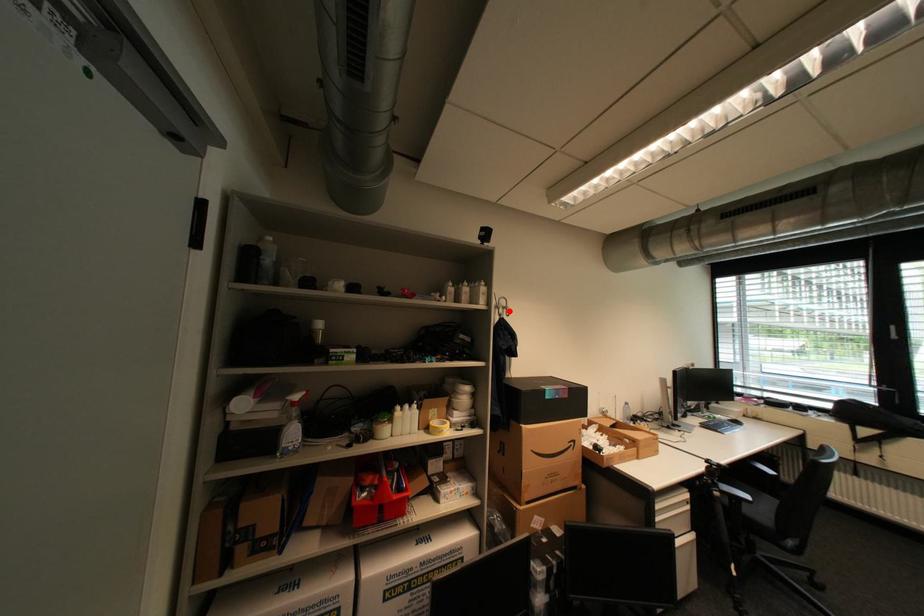
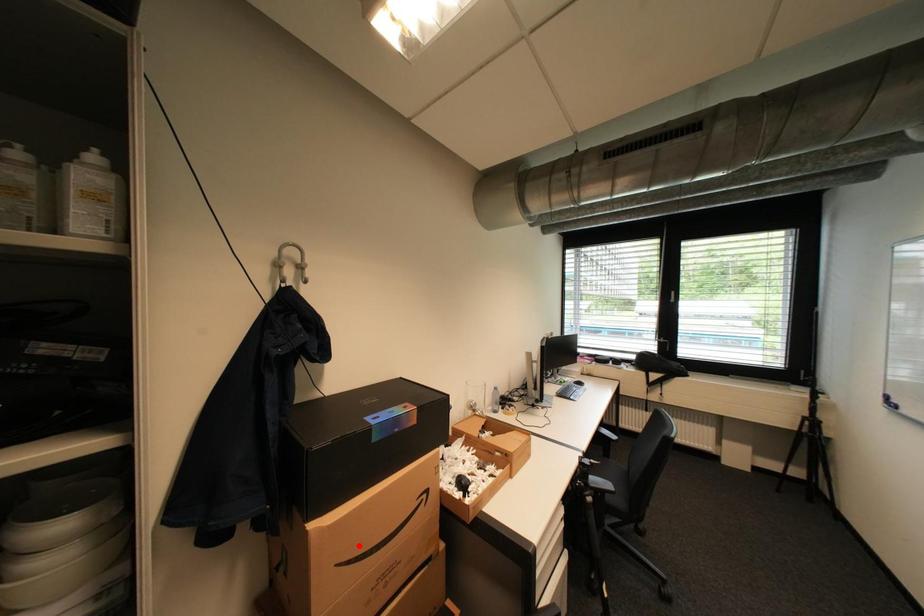
I am providing you with two images of the same scene from different viewpoints. A red point is marked on the first image and another point is marked on the second image. Are the points marked in image1 and image2 representing the same 3D position?

No